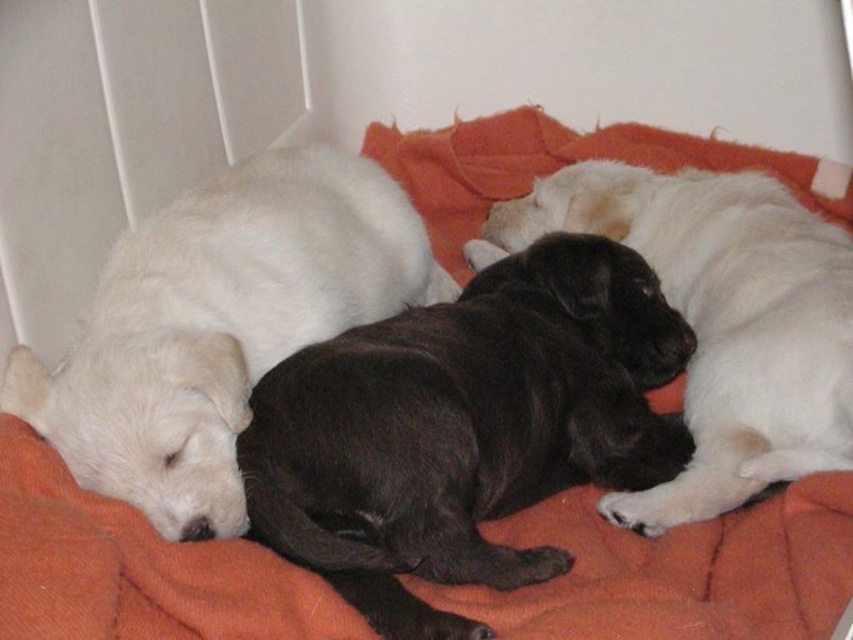
Is the position of black soft fur puppy at center more distant than that of black smooth fur at center?

No, black soft fur puppy at center is closer to the viewer.

Is black soft fur puppy at center shorter than black smooth fur at center?

Yes.

In order to click on black soft fur puppy at center in this screenshot , I will do `click(463, 428)`.

Is white soft fur at left further to the viewer compared to black smooth fur at center?

No, white soft fur at left is in front of black smooth fur at center.

Which of these two, white soft fur at left or black smooth fur at center, stands taller?

Standing taller between the two is black smooth fur at center.

Is point (141, 481) positioned behind point (788, 380)?

No.

The height and width of the screenshot is (640, 853). Identify the location of white soft fur at left. (219, 326).

Is black soft fur puppy at center below white soft fur at left?

Yes.

In the scene shown: Between black soft fur puppy at center and white soft fur at left, which one appears on the right side from the viewer's perspective?

From the viewer's perspective, black soft fur puppy at center appears more on the right side.

The width and height of the screenshot is (853, 640). What do you see at coordinates (463, 428) in the screenshot?
I see `black soft fur puppy at center` at bounding box center [463, 428].

The width and height of the screenshot is (853, 640). I want to click on black soft fur puppy at center, so click(463, 428).